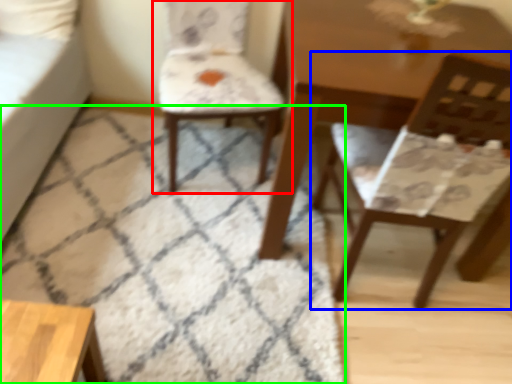
Question: Which object is the farthest from chair (highlighted by a red box)? Choose among these: chair (highlighted by a blue box) or mat (highlighted by a green box).

Choices:
 (A) chair
 (B) mat

Answer: (A)